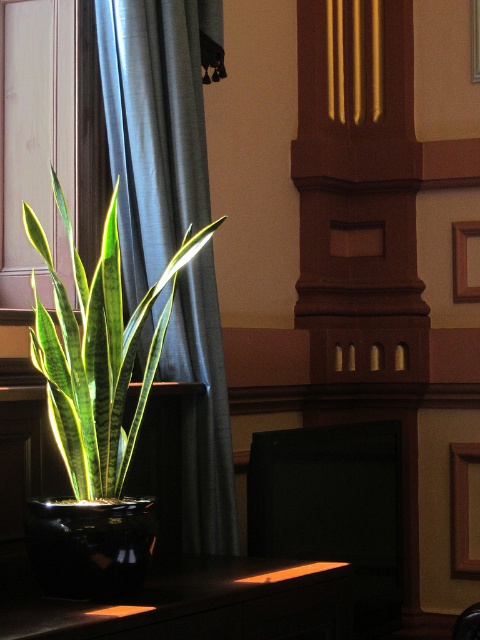
Question: Where is satin blue curtain at left located in relation to wooden picture frame at upper center in the image?

Choices:
 (A) right
 (B) left

Answer: (B)

Question: Which point appears closest to the camera in this image?

Choices:
 (A) (476, 38)
 (B) (464, 497)
 (C) (0, 618)
 (D) (142, 65)

Answer: (C)

Question: Which object is farther from the camera taking this photo?

Choices:
 (A) wooden frame at center-right
 (B) green glossy snake plant at left
 (C) satin blue curtain at left

Answer: (A)

Question: Can you confirm if black glossy table at lower center is positioned to the right of wooden picture frame at upper center?

Choices:
 (A) no
 (B) yes

Answer: (A)

Question: Which point appears closest to the camera in this image?

Choices:
 (A) (455, 224)
 (B) (144, 112)

Answer: (B)

Question: Can you confirm if satin blue curtain at left is smaller than green glossy snake plant at left?

Choices:
 (A) yes
 (B) no

Answer: (B)